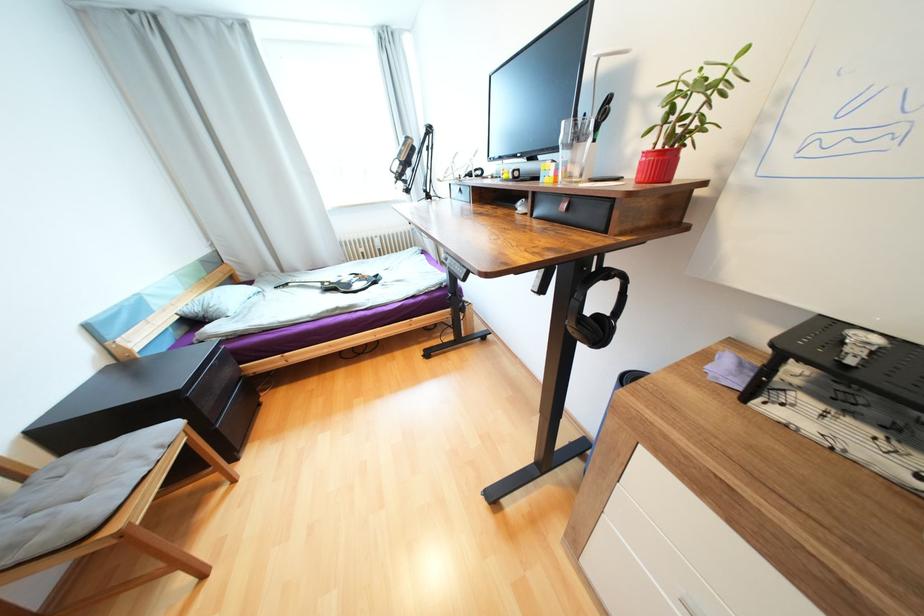
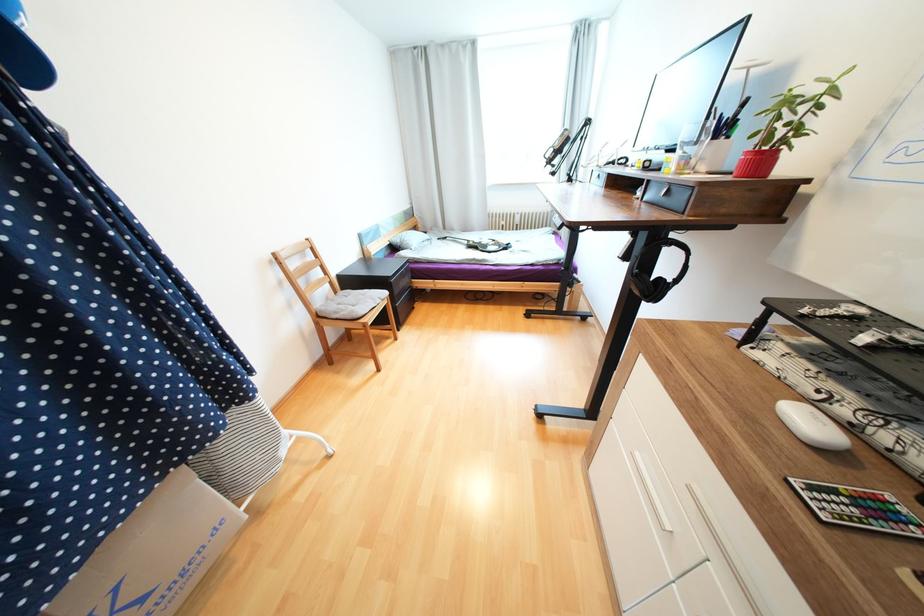
Where in the second image is the point corresponding to point (651, 154) from the first image?

(752, 153)